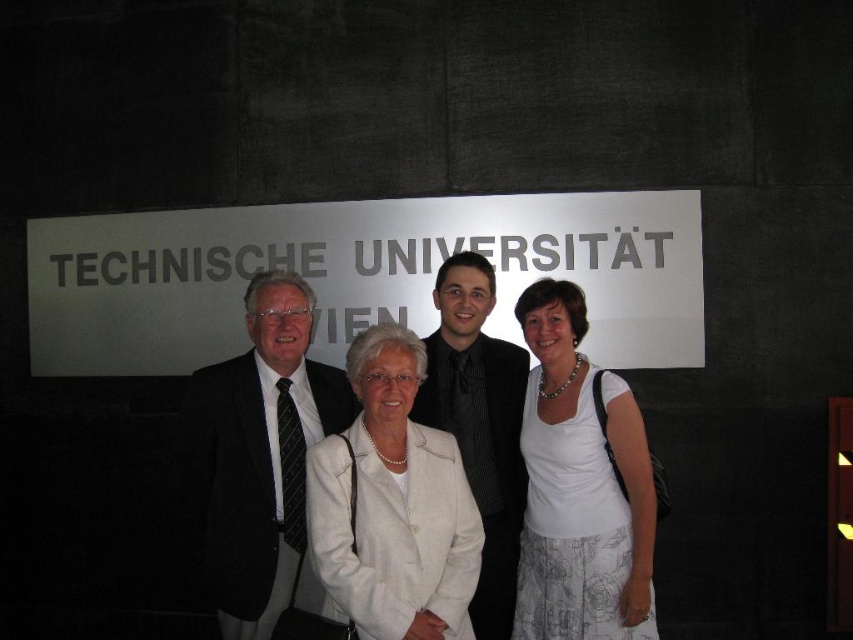
In the scene shown: You are a photographer planning to take a group photo of the two people in the center. The white fabric skirt at center and the black textured suit at center are both in focus. Which one will appear larger in the photo?

The white fabric skirt at center will appear larger in the photo because it is bigger than the black textured suit at center.

You are standing in front of the TECHNISCHE UNIVERSITAT WIEN sign. There are two points marked in the image. The first point is at coordinates point (322, 515) and the second point is at point (436, 410). Which of these two points is closer to you?

Point (322, 515) is in front of point (436, 410), so it is closer to you.

You are a fashion designer observing the group in front of the Technical University of Vienna sign. You notice the white fabric coat at center and the black textured suit at center. Which clothing item appears shorter in height?

The white fabric coat at center is not as tall as the black textured suit at center, so the white fabric coat at center appears shorter in height.